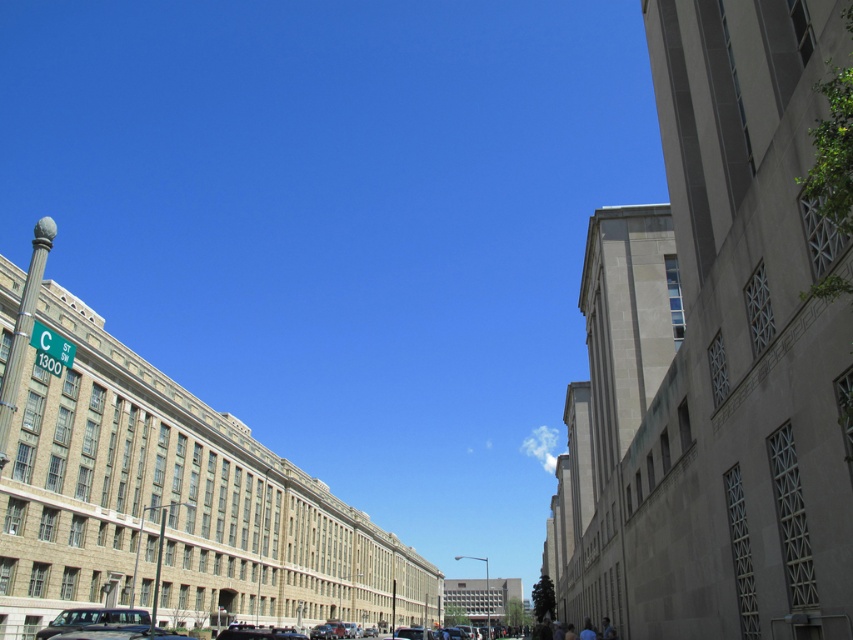
Can you confirm if metallic silver van at lower center is thinner than light brown hair at lower right?

In fact, metallic silver van at lower center might be wider than light brown hair at lower right.

Describe the element at coordinates (97, 621) in the screenshot. This screenshot has width=853, height=640. I see `metallic silver van at lower center` at that location.

Which is behind, point (71, 621) or point (583, 637)?

Point (583, 637)

You are a GUI agent. You are given a task and a screenshot of the screen. Output one action in this format:
    pyautogui.click(x=<x>, y=<y>)
    Task: Click on the metallic silver van at lower center
    The width and height of the screenshot is (853, 640).
    Given the screenshot: What is the action you would take?
    pyautogui.click(x=97, y=621)

The image size is (853, 640). Identify the location of metallic silver van at lower center. (97, 621).

Does point (94, 609) come closer to viewer compared to point (602, 634)?

No, it is behind (602, 634).

Who is more forward, (x=155, y=634) or (x=606, y=618)?

Point (x=155, y=634)

Identify the location of metallic silver van at lower center. (97, 621).

Is light brown hair at lower right shorter than blue fabric shirt at lower right?

Incorrect, light brown hair at lower right's height does not fall short of blue fabric shirt at lower right's.

How far apart are light brown hair at lower right and blue fabric shirt at lower right?

light brown hair at lower right is 3.57 meters away from blue fabric shirt at lower right.

Does point (582, 636) lie behind point (602, 634)?

That is False.

Where is `light brown hair at lower right`? light brown hair at lower right is located at coordinates (587, 628).